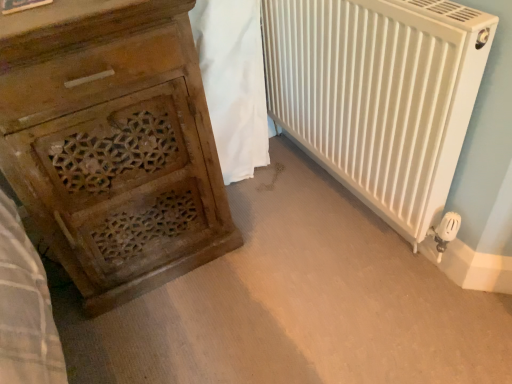
Question: Do you think white fabric at center is within white matte radiator at right, or outside of it?

Choices:
 (A) outside
 (B) inside

Answer: (A)

Question: In terms of width, does white fabric at center look wider or thinner when compared to white matte radiator at right?

Choices:
 (A) wide
 (B) thin

Answer: (A)

Question: Which object is the closest to the white matte radiator at right?

Choices:
 (A) white fabric at center
 (B) wooden carved chest of drawers at left

Answer: (A)

Question: Estimate the real-world distances between objects in this image. Which object is closer to the white matte radiator at right?

Choices:
 (A) wooden carved chest of drawers at left
 (B) white fabric at center

Answer: (B)